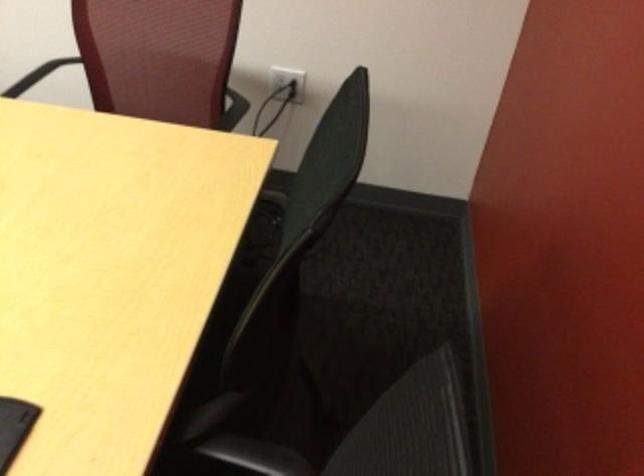
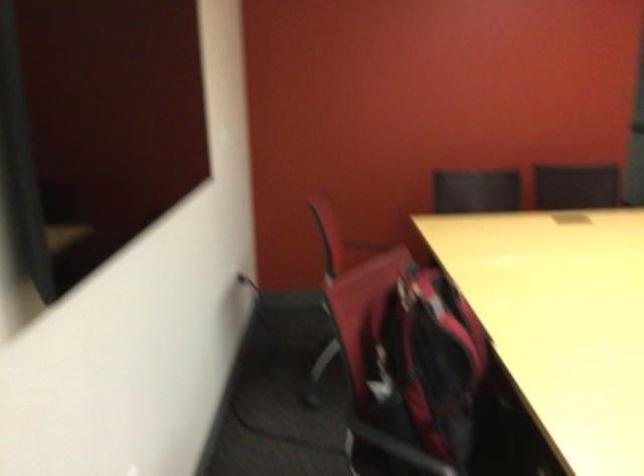
Question: I am providing you with two images of the same scene from different viewpoints. Which of the following objects are not visible in image2?

Choices:
 (A) red and white lighter
 (B) red chair sitting surface
 (C) black chair armrest
 (D) black electrical plug

Answer: (D)